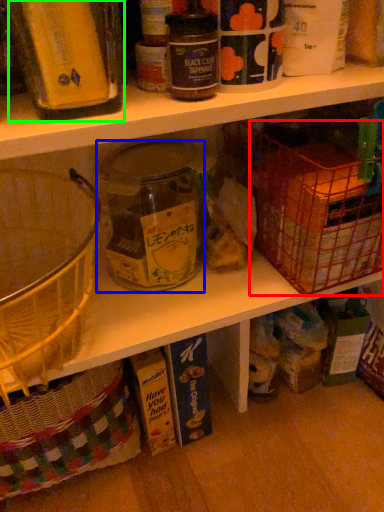
Question: Based on their relative distances, which object is nearer to basket (highlighted by a red box)? Choose from glass jar (highlighted by a blue box) and bottle (highlighted by a green box).

Choices:
 (A) glass jar
 (B) bottle

Answer: (A)